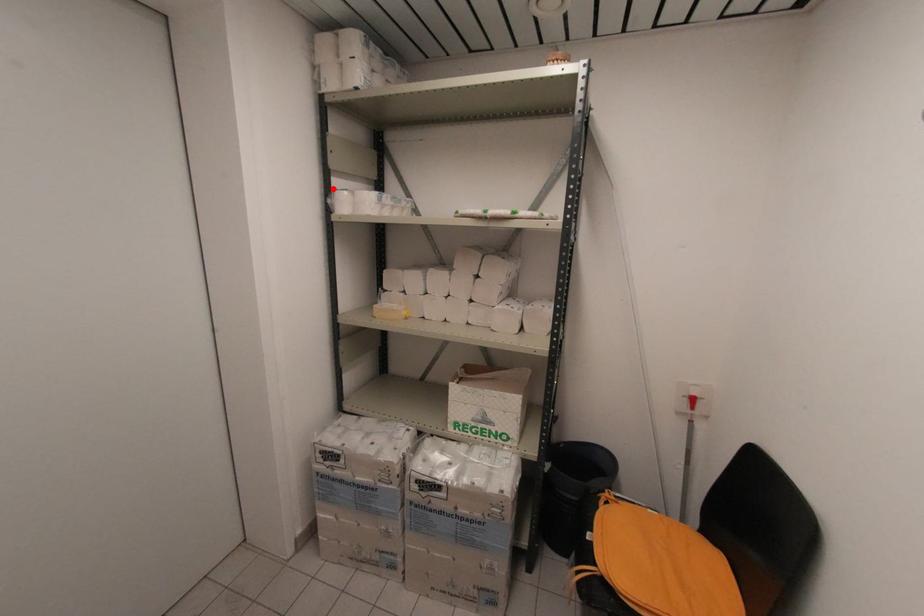
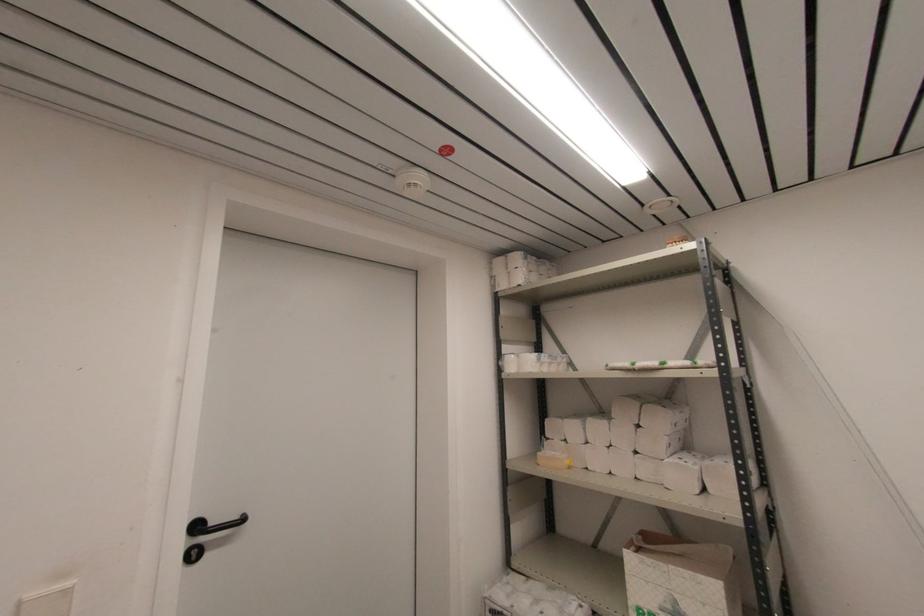
Find the pixel in the second image that matches the highlighted location in the first image.

(504, 354)